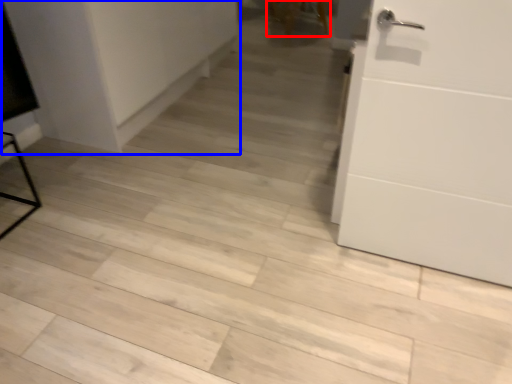
Question: Which point is further to the camera, chair (highlighted by a red box) or cabinetry (highlighted by a blue box)?

Choices:
 (A) chair
 (B) cabinetry

Answer: (A)